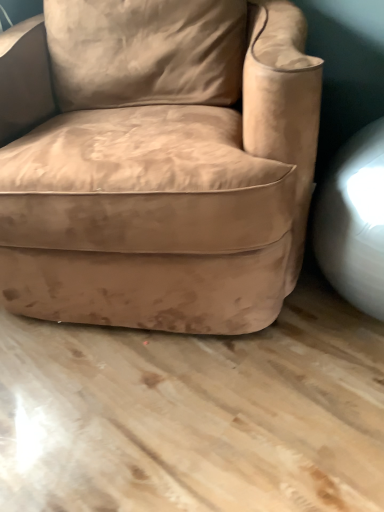
You are a GUI agent. You are given a task and a screenshot of the screen. Output one action in this format:
    pyautogui.click(x=<x>, y=<y>)
    Task: Click on the suede beige chair at center
    
    Given the screenshot: What is the action you would take?
    pyautogui.click(x=156, y=163)

What do you see at coordinates (156, 163) in the screenshot?
I see `suede beige chair at center` at bounding box center [156, 163].

Find the location of a particular element. Image resolution: width=384 pixels, height=512 pixels. suede beige chair at center is located at coordinates (156, 163).